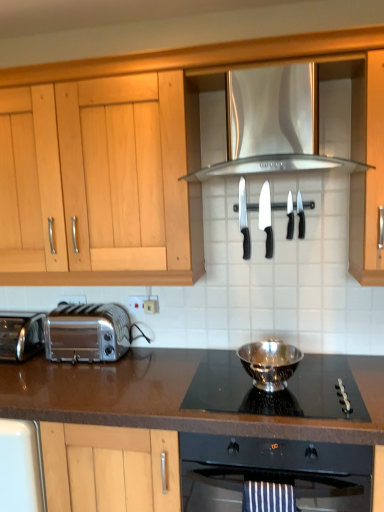
Locate an element on the screen. free spot in front of shiny metallic toaster at left, arranged as the first toaster when viewed from the right is located at coordinates (80, 386).